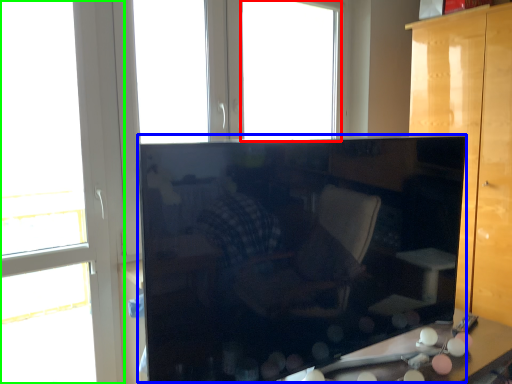
Question: Based on their relative distances, which object is nearer to window (highlighted by a red box)? Choose from cabinetry (highlighted by a blue box) and window (highlighted by a green box).

Choices:
 (A) cabinetry
 (B) window

Answer: (B)